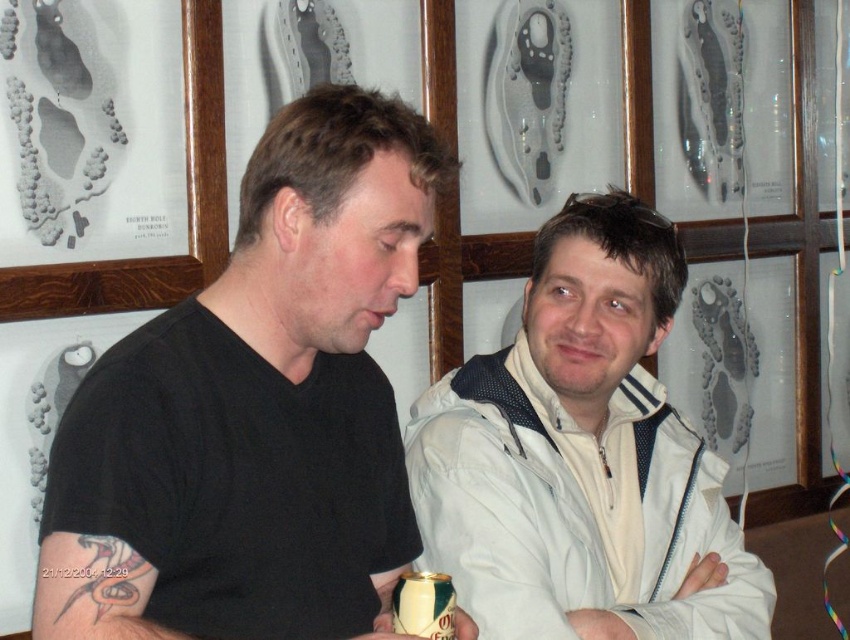
This screenshot has width=850, height=640. Describe the element at coordinates (582, 458) in the screenshot. I see `white matte jacket at center` at that location.

Does white matte jacket at center appear under green matte can at lower center?

No, white matte jacket at center is not below green matte can at lower center.

The image size is (850, 640). What do you see at coordinates (582, 458) in the screenshot? I see `white matte jacket at center` at bounding box center [582, 458].

I want to click on white matte jacket at center, so click(582, 458).

Looking at this image, is black matte shirt at center behind white matte jacket at center?

No, black matte shirt at center is in front of white matte jacket at center.

Locate an element on the screen. Image resolution: width=850 pixels, height=640 pixels. black matte shirt at center is located at coordinates (256, 406).

In the scene shown: Does black matte shirt at center have a lesser height compared to green matte can at lower center?

No, black matte shirt at center is not shorter than green matte can at lower center.

Between point (301, 634) and point (440, 580), which one is positioned behind?

The point (301, 634) is behind.

The image size is (850, 640). Find the location of `black matte shirt at center`. black matte shirt at center is located at coordinates (256, 406).